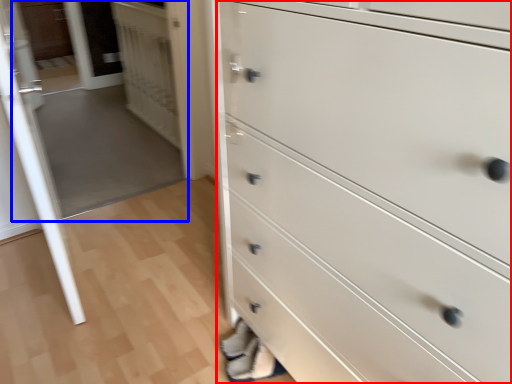
Question: Among these objects, which one is farthest to the camera, chest of drawers (highlighted by a red box) or glass door (highlighted by a blue box)?

Choices:
 (A) chest of drawers
 (B) glass door

Answer: (B)